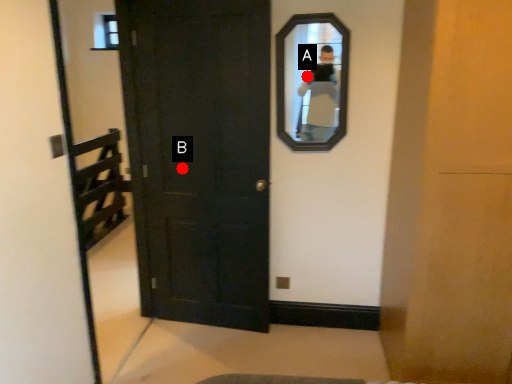
Question: Two points are circled on the image, labeled by A and B beside each circle. Which point is farther to the camera?

Choices:
 (A) A is further
 (B) B is further

Answer: (A)